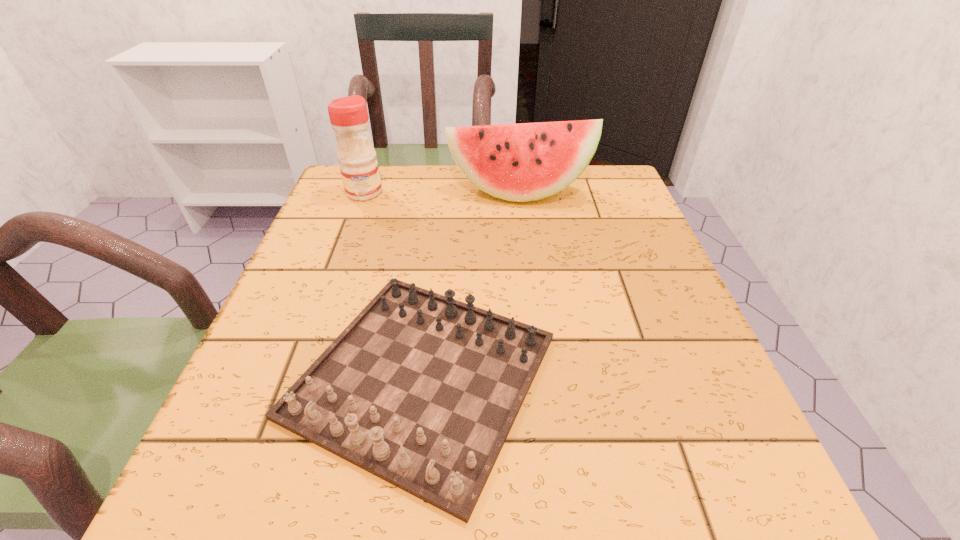
Locate an element on the screen. condiment located at the left edge is located at coordinates (349, 118).

I want to click on chessboard that is at the left edge, so click(x=421, y=390).

Find the location of a particular element. This screenshot has width=960, height=540. object that is positioned at the right edge is located at coordinates (523, 162).

This screenshot has height=540, width=960. In order to click on object positioned at the far left corner in this screenshot , I will do `click(349, 118)`.

Locate an element on the screen. object that is at the near left corner is located at coordinates (421, 390).

Identify the location of object situated at the far right corner. The width and height of the screenshot is (960, 540). (523, 162).

At what (x,y) coordinates should I click in order to perform the action: click on blank area at the far edge. Please return your answer as a coordinate pair (x, y). The image size is (960, 540). Looking at the image, I should click on (431, 190).

At what (x,y) coordinates should I click in order to perform the action: click on vacant space at the near edge of the desktop. Please return your answer as a coordinate pair (x, y). Image resolution: width=960 pixels, height=540 pixels. Looking at the image, I should click on (556, 461).

Find the location of `vacant position at the left edge of the desktop`. vacant position at the left edge of the desktop is located at coordinates (303, 281).

The image size is (960, 540). In the image, there is a desktop. In order to click on vacant region at the right edge in this screenshot , I will do `click(589, 275)`.